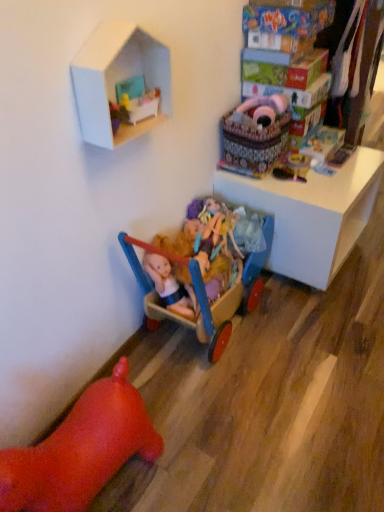
Describe the element at coordinates (340, 155) in the screenshot. I see `wooden toy car at upper right, the first toy when ordered from right to left` at that location.

What is the approximate height of white cardboard dollhouse at upper center?

The height of white cardboard dollhouse at upper center is 26.65 centimeters.

Measure the distance between white cardboard dollhouse at upper center and camera.

They are 37.73 inches apart.

Describe the element at coordinates (292, 167) in the screenshot. The image size is (384, 512). I see `wooden toy at center, the sixth toy viewed from the left` at that location.

Image resolution: width=384 pixels, height=512 pixels. What do you see at coordinates (311, 214) in the screenshot? I see `white glossy table at upper right` at bounding box center [311, 214].

The height and width of the screenshot is (512, 384). Describe the element at coordinates (203, 285) in the screenshot. I see `wooden wagon at lower center, the third toy positioned from the left` at that location.

Describe the element at coordinates (204, 250) in the screenshot. This screenshot has width=384, height=512. I see `wooden doll carriage at center, which is the sixth toy in right-to-left order` at that location.

At what (x,y) coordinates should I click in order to perform the action: click on wooden toy car at upper right, the first toy when ordered from right to left. Please return your answer as a coordinate pair (x, y). The height and width of the screenshot is (512, 384). Looking at the image, I should click on (340, 155).

Considering the positions of objects wooden wagon at lower center, the third toy positioned from the left, and wooden doll carriage at upper center, which is counted as the 4th toy, starting from the right, in the image provided, who is more to the left, wooden wagon at lower center, the third toy positioned from the left, or wooden doll carriage at upper center, which is counted as the 4th toy, starting from the right,?

wooden wagon at lower center, the third toy positioned from the left, is more to the left.

Between wooden wagon at lower center, which is the 5th toy in right-to-left order, and wooden doll carriage at upper center, acting as the 4th toy starting from the left, which one has larger width?

Wider between the two is wooden wagon at lower center, which is the 5th toy in right-to-left order.

Is wooden wagon at lower center, the third toy positioned from the left, spatially inside wooden doll carriage at upper center, acting as the 4th toy starting from the left, or outside of it?

wooden wagon at lower center, the third toy positioned from the left, is not inside wooden doll carriage at upper center, acting as the 4th toy starting from the left, it's outside.

Considering the sizes of objects wooden wagon at lower center, the third toy positioned from the left, and wooden doll carriage at upper center, acting as the 4th toy starting from the left, in the image provided, who is bigger, wooden wagon at lower center, the third toy positioned from the left, or wooden doll carriage at upper center, acting as the 4th toy starting from the left,?

Bigger between the two is wooden wagon at lower center, the third toy positioned from the left.

Is wooden toy car at upper right, the first toy when ordered from right to left, inside the boundaries of wooden doll carriage at center, which is the sixth toy in right-to-left order, or outside?

wooden toy car at upper right, the first toy when ordered from right to left, is located beyond the bounds of wooden doll carriage at center, which is the sixth toy in right-to-left order.

In terms of size, does wooden toy car at upper right, the first toy when ordered from right to left, appear bigger or smaller than wooden doll carriage at center, which is the sixth toy in right-to-left order?

Clearly, wooden toy car at upper right, the first toy when ordered from right to left, is smaller in size than wooden doll carriage at center, which is the sixth toy in right-to-left order.

Which object is further away from the camera taking this photo, wooden toy car at upper right, the first toy when ordered from right to left, or wooden doll carriage at center, positioned as the second toy in left-to-right order?

wooden toy car at upper right, the first toy when ordered from right to left, is further away from the camera.

Which toy is the 4th one when counting from the back of the wooden doll carriage at center, which is the sixth toy in right-to-left order? Please provide its 2D coordinates.

[(340, 155)]

Consider the image. Is the position of velvet pink baby carriage at upper right, the third toy positioned from the right, less distant than that of wooden toy at center, the sixth toy viewed from the left?

Yes, velvet pink baby carriage at upper right, the third toy positioned from the right, is closer to the viewer.

Based on the photo, how far apart are velvet pink baby carriage at upper right, the third toy positioned from the right, and wooden toy at center, the sixth toy viewed from the left?

velvet pink baby carriage at upper right, the third toy positioned from the right, and wooden toy at center, the sixth toy viewed from the left, are 6.33 inches apart from each other.

Is velvet pink baby carriage at upper right, which is counted as the 5th toy, starting from the left, smaller than wooden toy at center, the 2th toy in the right-to-left sequence?

Incorrect, velvet pink baby carriage at upper right, which is counted as the 5th toy, starting from the left, is not smaller in size than wooden toy at center, the 2th toy in the right-to-left sequence.

Would you say velvet pink baby carriage at upper right, the third toy positioned from the right, is outside wooden toy at center, the sixth toy viewed from the left?

velvet pink baby carriage at upper right, the third toy positioned from the right, is positioned outside wooden toy at center, the sixth toy viewed from the left.

Is wooden toy at center, the sixth toy viewed from the left, closer to the viewer compared to velvet pink baby carriage at upper right, which is counted as the 5th toy, starting from the left?

No, it is behind velvet pink baby carriage at upper right, which is counted as the 5th toy, starting from the left.

Which object is thinner, wooden toy at center, the 2th toy in the right-to-left sequence, or velvet pink baby carriage at upper right, the third toy positioned from the right?

wooden toy at center, the 2th toy in the right-to-left sequence, is thinner.

Can you confirm if wooden toy at center, the 2th toy in the right-to-left sequence, is taller than velvet pink baby carriage at upper right, the third toy positioned from the right?

No.

Which is behind, point (305, 158) or point (221, 160)?

Point (305, 158)

In the image, is velvet pink baby carriage at upper right, which is counted as the 5th toy, starting from the left, positioned in front of or behind wooden doll carriage at center, positioned as the second toy in left-to-right order?

velvet pink baby carriage at upper right, which is counted as the 5th toy, starting from the left, is positioned farther from the viewer than wooden doll carriage at center, positioned as the second toy in left-to-right order.

From a real-world perspective, who is located lower, velvet pink baby carriage at upper right, which is counted as the 5th toy, starting from the left, or wooden doll carriage at center, positioned as the second toy in left-to-right order?

wooden doll carriage at center, positioned as the second toy in left-to-right order, is physically lower.

Is velvet pink baby carriage at upper right, the third toy positioned from the right, completely or partially outside of wooden doll carriage at center, positioned as the second toy in left-to-right order?

velvet pink baby carriage at upper right, the third toy positioned from the right, lies outside wooden doll carriage at center, positioned as the second toy in left-to-right order,'s area.

Is wooden wagon at lower center, the third toy positioned from the left, situated inside wooden doll carriage at center, positioned as the second toy in left-to-right order, or outside?

wooden wagon at lower center, the third toy positioned from the left, is outside wooden doll carriage at center, positioned as the second toy in left-to-right order.

Is wooden wagon at lower center, which is the 5th toy in right-to-left order, placed right next to wooden doll carriage at center, which is the sixth toy in right-to-left order?

Yes, wooden wagon at lower center, which is the 5th toy in right-to-left order, is in contact with wooden doll carriage at center, which is the sixth toy in right-to-left order.

Can you confirm if wooden wagon at lower center, which is the 5th toy in right-to-left order, is positioned to the left of wooden doll carriage at center, which is the sixth toy in right-to-left order?

No.

Considering their positions, is wooden wagon at lower center, which is the 5th toy in right-to-left order, located in front of or behind wooden doll carriage at center, positioned as the second toy in left-to-right order?

Clearly, wooden wagon at lower center, which is the 5th toy in right-to-left order, is in front of wooden doll carriage at center, positioned as the second toy in left-to-right order.

Locate an element on the screen. the 1st toy positioned below the wooden doll carriage at upper center, acting as the 4th toy starting from the left (from the image's perspective) is located at coordinates (255, 135).

Between velvet pink baby carriage at upper right, the third toy positioned from the right, and wooden doll carriage at upper center, which is counted as the 4th toy, starting from the right, which one is positioned behind?

wooden doll carriage at upper center, which is counted as the 4th toy, starting from the right, is further away from the camera.

From the picture: From the image's perspective, is velvet pink baby carriage at upper right, the third toy positioned from the right, located above or below wooden doll carriage at upper center, acting as the 4th toy starting from the left?

Based on their image positions, velvet pink baby carriage at upper right, the third toy positioned from the right, is located beneath wooden doll carriage at upper center, acting as the 4th toy starting from the left.

Where is `the 3rd toy behind when counting from the wooden wagon at lower center, which is the 5th toy in right-to-left order`? This screenshot has height=512, width=384. the 3rd toy behind when counting from the wooden wagon at lower center, which is the 5th toy in right-to-left order is located at coordinates (261, 110).

Where is `toy that is the 1st object directly below the wooden toy car at upper right, the first toy when ordered from right to left (from a real-world perspective)`? The width and height of the screenshot is (384, 512). toy that is the 1st object directly below the wooden toy car at upper right, the first toy when ordered from right to left (from a real-world perspective) is located at coordinates (204, 250).

Considering their positions, is white glossy table at upper right positioned closer to wooden toy car at upper right, which ranks as the seventh toy in left-to-right order, than wooden toy at center, the 2th toy in the right-to-left sequence?

wooden toy at center, the 2th toy in the right-to-left sequence.

Considering their positions, is white cardboard dollhouse at upper center positioned further to rubber pig at lower left, the seventh toy viewed from the right, than white glossy table at upper right?

The object further to rubber pig at lower left, the seventh toy viewed from the right, is white glossy table at upper right.

Based on their spatial positions, is wooden wagon at lower center, which is the 5th toy in right-to-left order, or white glossy table at upper right closer to rubber pig at lower left, the 1th toy when ordered from left to right?

wooden wagon at lower center, which is the 5th toy in right-to-left order.

Estimate the real-world distances between objects in this image. Which object is closer to rubber pig at lower left, the 1th toy when ordered from left to right, wooden toy car at upper right, which ranks as the seventh toy in left-to-right order, or wooden doll carriage at center, which is the sixth toy in right-to-left order?

Based on the image, wooden doll carriage at center, which is the sixth toy in right-to-left order, appears to be nearer to rubber pig at lower left, the 1th toy when ordered from left to right.

From the image, which object appears to be nearer to wooden doll carriage at center, which is the sixth toy in right-to-left order, rubber pig at lower left, the 1th toy when ordered from left to right, or wooden doll carriage at upper center, acting as the 4th toy starting from the left?

The object closer to wooden doll carriage at center, which is the sixth toy in right-to-left order, is wooden doll carriage at upper center, acting as the 4th toy starting from the left.

Based on their spatial positions, is white cardboard dollhouse at upper center or wooden doll carriage at center, positioned as the second toy in left-to-right order, closer to wooden wagon at lower center, which is the 5th toy in right-to-left order?

Among the two, wooden doll carriage at center, positioned as the second toy in left-to-right order, is located nearer to wooden wagon at lower center, which is the 5th toy in right-to-left order.

When comparing their distances from wooden wagon at lower center, the third toy positioned from the left, does rubber pig at lower left, the seventh toy viewed from the right, or wooden toy at center, the sixth toy viewed from the left, seem closer?

rubber pig at lower left, the seventh toy viewed from the right, lies closer to wooden wagon at lower center, the third toy positioned from the left, than the other object.

When comparing their distances from rubber pig at lower left, the 1th toy when ordered from left to right, does white glossy table at upper right or velvet pink baby carriage at upper right, the third toy positioned from the right, seem further?

velvet pink baby carriage at upper right, the third toy positioned from the right, is further to rubber pig at lower left, the 1th toy when ordered from left to right.

The image size is (384, 512). I want to click on table located between rubber pig at lower left, the seventh toy viewed from the right, and wooden toy car at upper right, which ranks as the seventh toy in left-to-right order, in the depth direction, so pyautogui.click(x=311, y=214).

This screenshot has width=384, height=512. Identify the location of table between wooden doll carriage at upper center, which is counted as the 4th toy, starting from the right, and wooden wagon at lower center, which is the 5th toy in right-to-left order, in the vertical direction. (311, 214).

This screenshot has width=384, height=512. In order to click on toy positioned between velvet pink baby carriage at upper right, the third toy positioned from the right, and wooden toy at center, the 2th toy in the right-to-left sequence, from near to far in this screenshot , I will do `click(261, 110)`.

You are a GUI agent. You are given a task and a screenshot of the screen. Output one action in this format:
    pyautogui.click(x=<x>, y=<y>)
    Task: Click on the table between rubber pig at lower left, the seventh toy viewed from the right, and wooden toy at center, the 2th toy in the right-to-left sequence, in the front-back direction
    
    Given the screenshot: What is the action you would take?
    pyautogui.click(x=311, y=214)